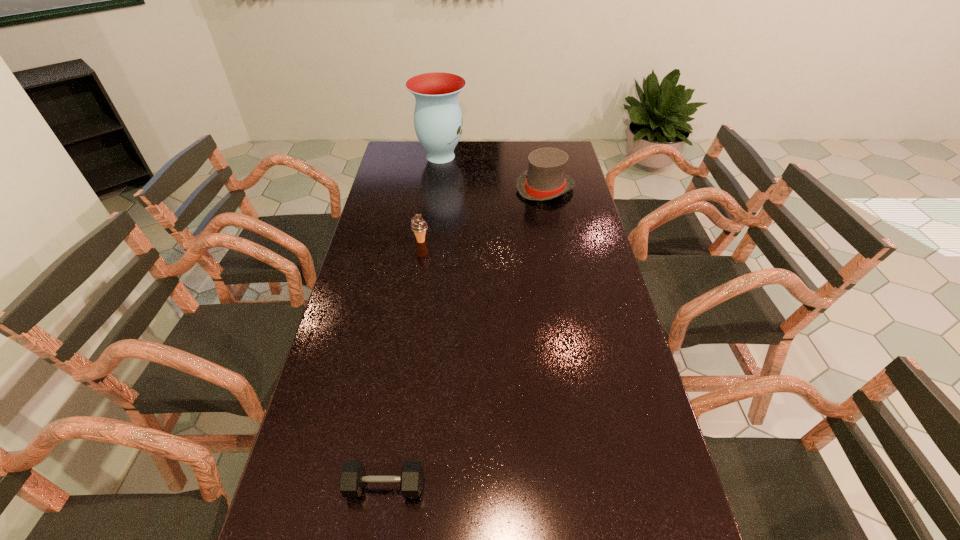
This screenshot has height=540, width=960. I want to click on vacant space located on the back of the icecream, so click(426, 204).

The image size is (960, 540). I want to click on vacant region located 0.060m on the right of the nearest object, so click(451, 486).

Image resolution: width=960 pixels, height=540 pixels. What are the coordinates of `object located in the far edge section of the desktop` in the screenshot? It's located at (438, 123).

In order to click on vase positioned at the left edge in this screenshot , I will do `click(438, 123)`.

In order to click on dumbbell situated at the left edge in this screenshot , I will do `click(352, 478)`.

I want to click on object present at the right edge, so click(x=545, y=179).

This screenshot has width=960, height=540. I want to click on object located at the far left corner, so click(x=438, y=123).

The height and width of the screenshot is (540, 960). I want to click on vacant space at the far edge of the desktop, so click(486, 148).

The image size is (960, 540). Identify the location of vacant space at the left edge. (420, 172).

The image size is (960, 540). In the image, there is a desktop. In order to click on free space at the right edge in this screenshot , I will do [599, 435].